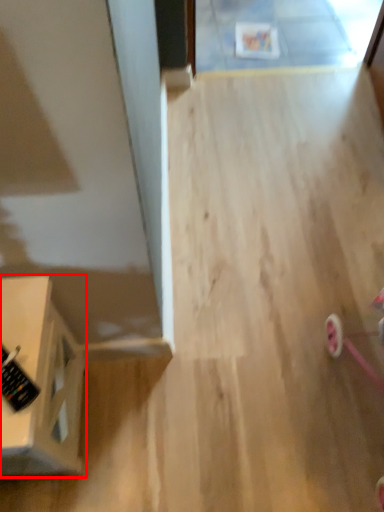
Question: From the image's perspective, what is the correct spatial positioning of furniture (annotated by the red box) in reference to control?

Choices:
 (A) below
 (B) above

Answer: (A)